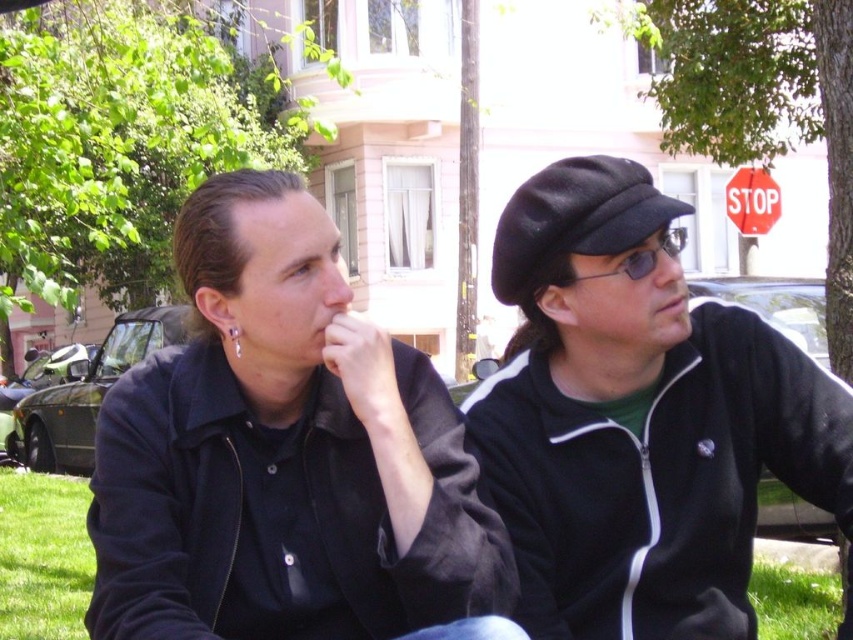
Does black matte jacket at left appear under green grass at lower left?

Incorrect, black matte jacket at left is not positioned below green grass at lower left.

Who is taller, black matte jacket at left or green grass at lower left?

With more height is black matte jacket at left.

Identify the location of black matte jacket at left. pyautogui.click(x=282, y=452).

Does black matte jacket at left lie behind black matte cap at upper right?

No, black matte jacket at left is in front of black matte cap at upper right.

Looking at this image, does black matte jacket at left appear on the right side of black matte cap at upper right?

In fact, black matte jacket at left is to the left of black matte cap at upper right.

What do you see at coordinates (282, 452) in the screenshot? The image size is (853, 640). I see `black matte jacket at left` at bounding box center [282, 452].

In order to click on black matte jacket at left in this screenshot , I will do `click(282, 452)`.

Which is behind, point (842, 390) or point (730, 180)?

Positioned behind is point (730, 180).

Can you confirm if black matte cap at upper right is taller than red plastic stop sign at upper right?

Yes, black matte cap at upper right is taller than red plastic stop sign at upper right.

Identify the location of black matte cap at upper right. The image size is (853, 640). (639, 419).